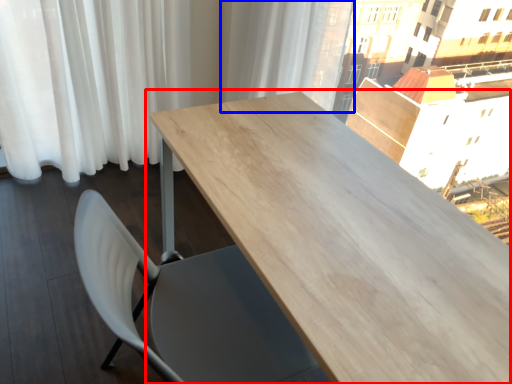
Question: Which object is further to the camera taking this photo, table (highlighted by a red box) or curtain (highlighted by a blue box)?

Choices:
 (A) table
 (B) curtain

Answer: (B)